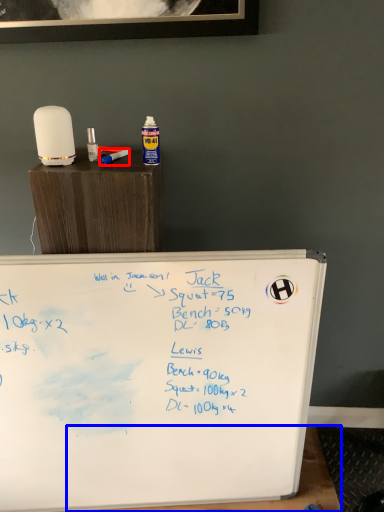
Question: Which object appears farthest to the camera in this image, paint brush (highlighted by a red box) or table (highlighted by a blue box)?

Choices:
 (A) paint brush
 (B) table

Answer: (B)